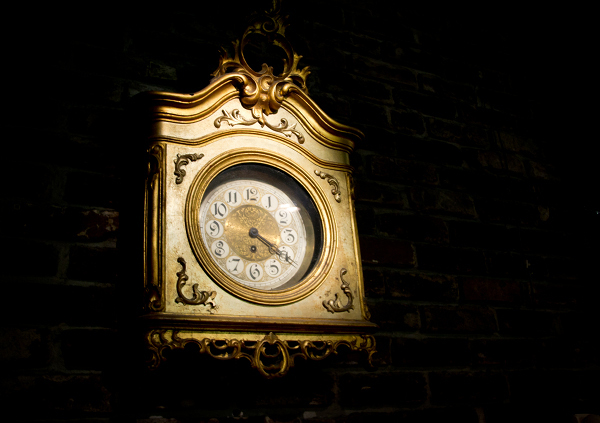
Identify the location of clock hand. (269, 244), (261, 241).